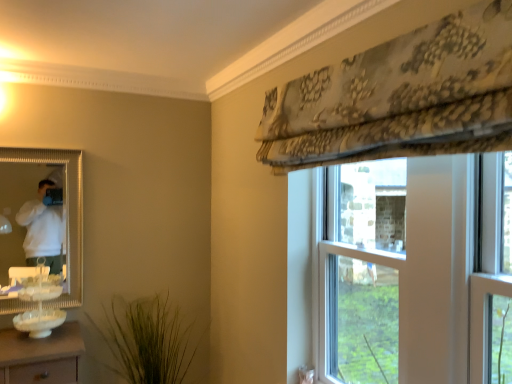
Question: Does point (368, 279) appear closer or farther from the camera than point (24, 314)?

Choices:
 (A) closer
 (B) farther

Answer: (A)

Question: Considering their positions, is clear glass window at center located in front of or behind white glassware at lower left?

Choices:
 (A) behind
 (B) front

Answer: (B)

Question: Which is farther from the white glassware at lower left?

Choices:
 (A) gold-framed mirror at left
 (B) clear glass window at center
 (C) green grass-like plant at lower center

Answer: (B)

Question: Estimate the real-world distances between objects in this image. Which object is farther from the clear glass window at center?

Choices:
 (A) green grass-like plant at lower center
 (B) white glassware at lower left
 (C) gold-framed mirror at left

Answer: (C)